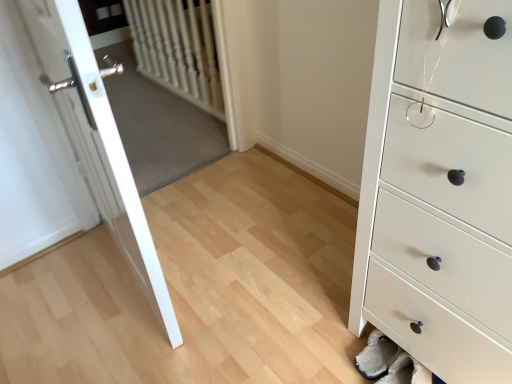
Question: Is the depth of white glossy door at left greater than that of white textured radiator at upper left?

Choices:
 (A) no
 (B) yes

Answer: (A)

Question: From a real-world perspective, is white glossy door at left located beneath white textured radiator at upper left?

Choices:
 (A) no
 (B) yes

Answer: (A)

Question: Is white glossy door at left far away from white textured radiator at upper left?

Choices:
 (A) yes
 (B) no

Answer: (A)

Question: Is white glossy door at left next to white textured radiator at upper left?

Choices:
 (A) yes
 (B) no

Answer: (B)

Question: Is white glossy door at left shorter than white textured radiator at upper left?

Choices:
 (A) no
 (B) yes

Answer: (A)

Question: In terms of width, does white glossy door at left look wider or thinner when compared to white matte chest of drawers at lower right?

Choices:
 (A) thin
 (B) wide

Answer: (A)

Question: Does point (110, 225) appear closer or farther from the camera than point (446, 322)?

Choices:
 (A) closer
 (B) farther

Answer: (B)

Question: Would you say white glossy door at left is inside or outside white matte chest of drawers at lower right?

Choices:
 (A) inside
 (B) outside

Answer: (B)

Question: From the image's perspective, is white glossy door at left positioned above or below white matte chest of drawers at lower right?

Choices:
 (A) above
 (B) below

Answer: (A)

Question: From a real-world perspective, is white matte chest of drawers at lower right above or below white textured radiator at upper left?

Choices:
 (A) below
 (B) above

Answer: (B)

Question: Is white matte chest of drawers at lower right in front of or behind white textured radiator at upper left in the image?

Choices:
 (A) behind
 (B) front

Answer: (B)

Question: Choose the correct answer: Is white matte chest of drawers at lower right inside white textured radiator at upper left or outside it?

Choices:
 (A) outside
 (B) inside

Answer: (A)

Question: Is point (412, 41) positioned closer to the camera than point (208, 71)?

Choices:
 (A) farther
 (B) closer

Answer: (B)

Question: In the image, is white textured radiator at upper left positioned in front of or behind white glossy door at left?

Choices:
 (A) behind
 (B) front

Answer: (A)

Question: Is white textured radiator at upper left inside the boundaries of white glossy door at left, or outside?

Choices:
 (A) outside
 (B) inside

Answer: (A)